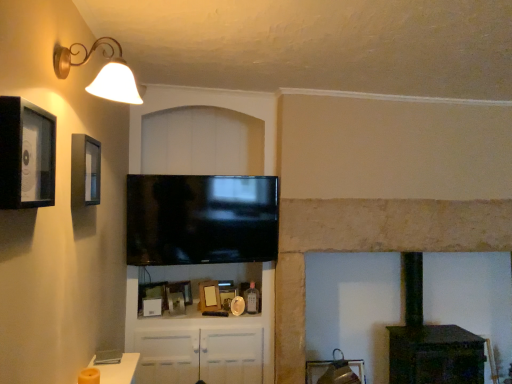
Question: Could you tell me if wooden picture frame at center, placed as the 2th picture frame when sorted from bottom to top, is facing wooden photo frame at center, which appears as the third picture frame when viewed from the front?

Choices:
 (A) yes
 (B) no

Answer: (A)

Question: Is wooden picture frame at center, which ranks as the 2th picture frame in back-to-front order, turned away from wooden photo frame at center, the third picture frame ordered from the bottom?

Choices:
 (A) no
 (B) yes

Answer: (A)

Question: Considering the relative positions of wooden picture frame at center, placed as the 2th picture frame when sorted from bottom to top, and wooden photo frame at center, which appears as the third picture frame when viewed from the top, in the image provided, is wooden picture frame at center, placed as the 2th picture frame when sorted from bottom to top, behind wooden photo frame at center, which appears as the third picture frame when viewed from the top,?

Choices:
 (A) no
 (B) yes

Answer: (B)

Question: From a real-world perspective, does wooden picture frame at center, placed as the 2th picture frame when sorted from bottom to top, sit lower than wooden photo frame at center, which appears as the third picture frame when viewed from the top?

Choices:
 (A) no
 (B) yes

Answer: (B)

Question: Does wooden picture frame at center, the 4th picture frame from the front, have a larger size compared to wooden photo frame at center, which appears as the third picture frame when viewed from the front?

Choices:
 (A) no
 (B) yes

Answer: (A)

Question: Is point (172, 304) positioned closer to the camera than point (205, 301)?

Choices:
 (A) closer
 (B) farther

Answer: (A)

Question: Considering the positions of wooden picture frame at center, which is counted as the 4th picture frame, starting from the top, and wooden photo frame at center, which appears as the third picture frame when viewed from the front, in the image, is wooden picture frame at center, which is counted as the 4th picture frame, starting from the top, wider or thinner than wooden photo frame at center, which appears as the third picture frame when viewed from the front,?

Choices:
 (A) wide
 (B) thin

Answer: (B)

Question: In the image, is wooden picture frame at center, placed as the 2th picture frame when sorted from bottom to top, positioned in front of or behind wooden photo frame at center, which appears as the third picture frame when viewed from the top?

Choices:
 (A) front
 (B) behind

Answer: (B)

Question: Is wooden picture frame at center, which is counted as the 4th picture frame, starting from the top, inside the boundaries of wooden photo frame at center, which appears as the third picture frame when viewed from the front, or outside?

Choices:
 (A) outside
 (B) inside

Answer: (A)

Question: Considering the relative positions of wooden picture frame at center, the 1th picture frame positioned from the bottom, and stone fireplace at center in the image provided, is wooden picture frame at center, the 1th picture frame positioned from the bottom, to the left or to the right of stone fireplace at center?

Choices:
 (A) right
 (B) left

Answer: (B)

Question: From a real-world perspective, relative to stone fireplace at center, is wooden picture frame at center, marked as the fifth picture frame in a top-to-bottom arrangement, vertically above or below?

Choices:
 (A) above
 (B) below

Answer: (B)

Question: Is wooden picture frame at center, marked as the fifth picture frame in a top-to-bottom arrangement, bigger or smaller than stone fireplace at center?

Choices:
 (A) big
 (B) small

Answer: (B)

Question: Considering the positions of wooden picture frame at center, the first picture frame when ordered from back to front, and stone fireplace at center in the image, is wooden picture frame at center, the first picture frame when ordered from back to front, wider or thinner than stone fireplace at center?

Choices:
 (A) thin
 (B) wide

Answer: (A)

Question: Looking at the image, does wooden photo frame at center, which appears as the third picture frame when viewed from the top, seem bigger or smaller compared to wooden picture frame at center, which is counted as the 4th picture frame, starting from the top?

Choices:
 (A) small
 (B) big

Answer: (B)

Question: Considering the positions of wooden photo frame at center, the third picture frame ordered from the bottom, and wooden picture frame at center, which is counted as the 4th picture frame, starting from the top, in the image, is wooden photo frame at center, the third picture frame ordered from the bottom, wider or thinner than wooden picture frame at center, which is counted as the 4th picture frame, starting from the top,?

Choices:
 (A) wide
 (B) thin

Answer: (A)